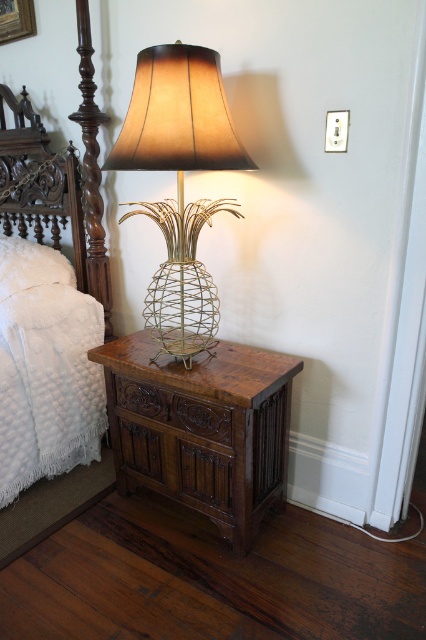
Does point (181, 396) come closer to viewer compared to point (0, 289)?

Yes, it is in front of point (0, 289).

Which is in front, point (227, 497) or point (37, 272)?

Positioned in front is point (227, 497).

Identify the location of brown carved wood drawer at lower center. (175, 440).

Does brown wood side table at lower center have a smaller size compared to gold wire pineapple lamp at center?

Yes.

Locate an element on the screen. This screenshot has height=640, width=426. brown wood side table at lower center is located at coordinates (201, 428).

Can you confirm if brown wood side table at lower center is shorter than brown carved wood drawer at lower center?

No, brown wood side table at lower center is not shorter than brown carved wood drawer at lower center.

Which of these two, brown wood side table at lower center or brown carved wood drawer at lower center, stands shorter?

With less height is brown carved wood drawer at lower center.

This screenshot has height=640, width=426. Describe the element at coordinates (201, 428) in the screenshot. I see `brown wood side table at lower center` at that location.

I want to click on brown wood side table at lower center, so click(201, 428).